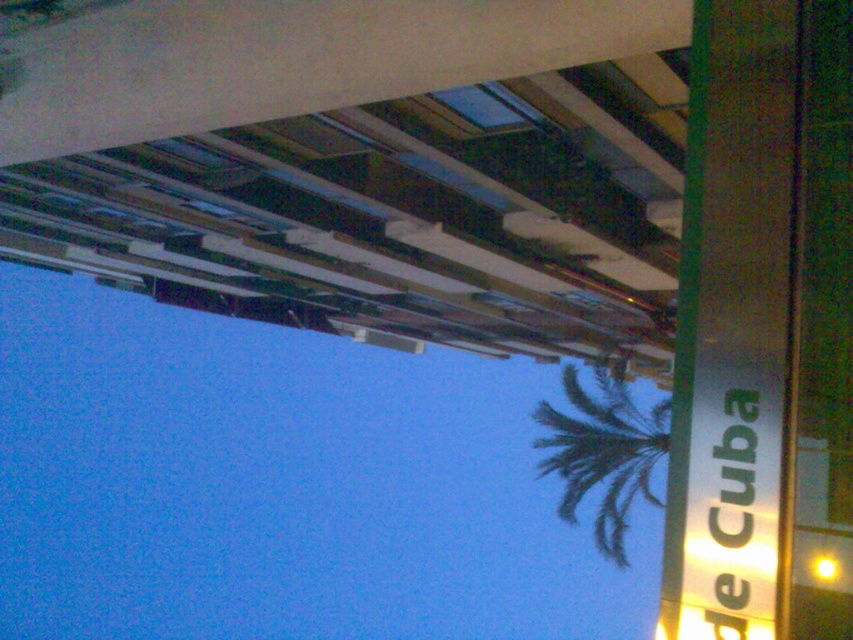
From the picture: Is silver metallic sign at right bigger than green leafy palm tree at center?

No.

Who is taller, silver metallic sign at right or green leafy palm tree at center?

Standing taller between the two is green leafy palm tree at center.

This screenshot has height=640, width=853. In order to click on silver metallic sign at right in this screenshot , I will do `click(732, 326)`.